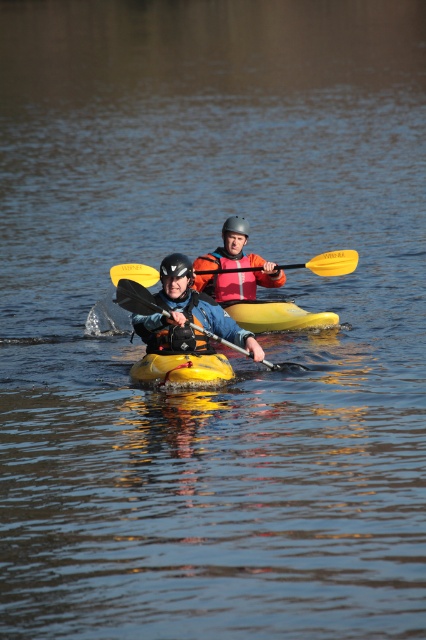
You are a safety inspector checking the kayakers. You notice the orange life vest at center and the yellow plastic paddle at center. Which item is smaller in size?

The orange life vest at center is smaller in size compared to the yellow plastic paddle at center.

You are a photographer trying to capture a clear shot of both the orange life vest at center and the yellow plastic paddle at center. Since you want both items to be in focus, you need to adjust your camera settings. Which object should you focus on to ensure both are sharp?

You should focus on the orange life vest at center because it is closer to the viewer than the yellow plastic paddle at center. By focusing on the closer object, the depth of field will extend backward, potentially keeping both objects in focus.